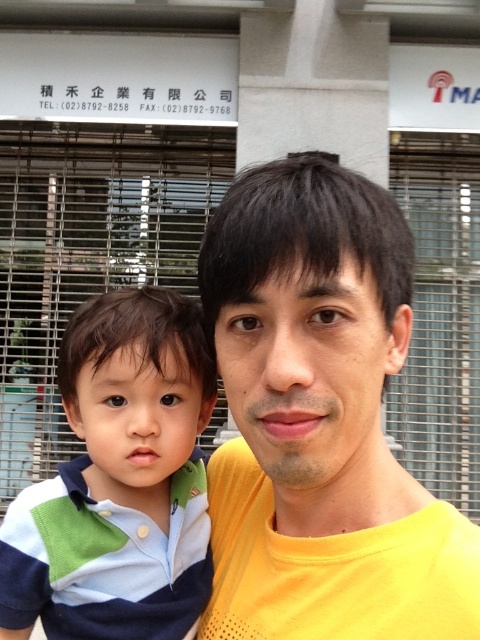
You are a photographer standing 20 inches away from the camera. You want to take a photo of the yellow matte shirt at center. Can you reach it without moving closer?

The yellow matte shirt at center is 22.22 inches away from viewer. Since you are 20 inches away from the camera, you are already close enough to reach the yellow matte shirt at center.

You are taking a photo of the two people in the image. The adult is wearing a yellow matte shirt at center and the child is wearing a striped cotton shirt at left. Which person will appear larger in the photo?

The yellow matte shirt at center is closer to the viewer than the striped cotton shirt at left, so the adult wearing the yellow matte shirt at center will appear larger in the photo.

You are standing in front of a building with two people nearby. There is a point at coordinates (349, 204). If you want to touch that point with a stick that is 20 inches long, will the stick be long enough?

The distance between the point at coordinates (349, 204) and the viewer is 24.13 inches, which is longer than the 20 inch stick. Therefore, the stick is not long enough to reach the point.